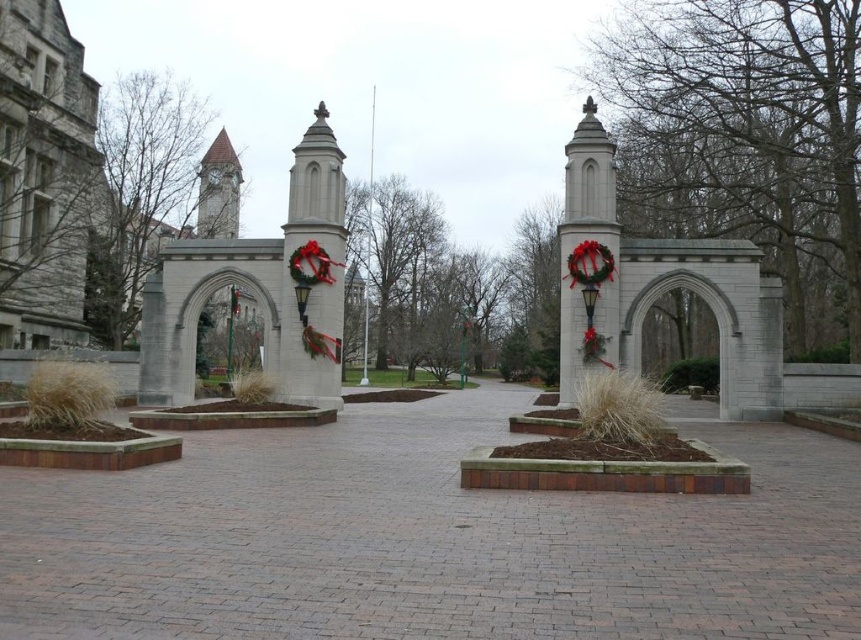
Is white stone archway at right to the right of brown stone clock tower at upper left from the viewer's perspective?

Yes, white stone archway at right is to the right of brown stone clock tower at upper left.

Does white stone archway at right have a larger size compared to brown stone clock tower at upper left?

Yes, white stone archway at right is bigger than brown stone clock tower at upper left.

Which is behind, point (747, 308) or point (221, 211)?

Positioned behind is point (221, 211).

Find the location of `white stone archway at right`. white stone archway at right is located at coordinates (666, 285).

Which is below, smooth stone archway at center or brown stone clock tower at upper left?

smooth stone archway at center is lower down.

The image size is (861, 640). In order to click on smooth stone archway at center in this screenshot , I will do `click(258, 288)`.

Can you confirm if smooth stone archway at center is smaller than white stone archway at right?

Yes.

Does smooth stone archway at center appear over white stone archway at right?

Indeed, smooth stone archway at center is positioned over white stone archway at right.

Who is more forward, (x=189, y=401) or (x=682, y=257)?

Point (x=682, y=257) is more forward.

What are the coordinates of `smooth stone archway at center` in the screenshot? It's located at (258, 288).